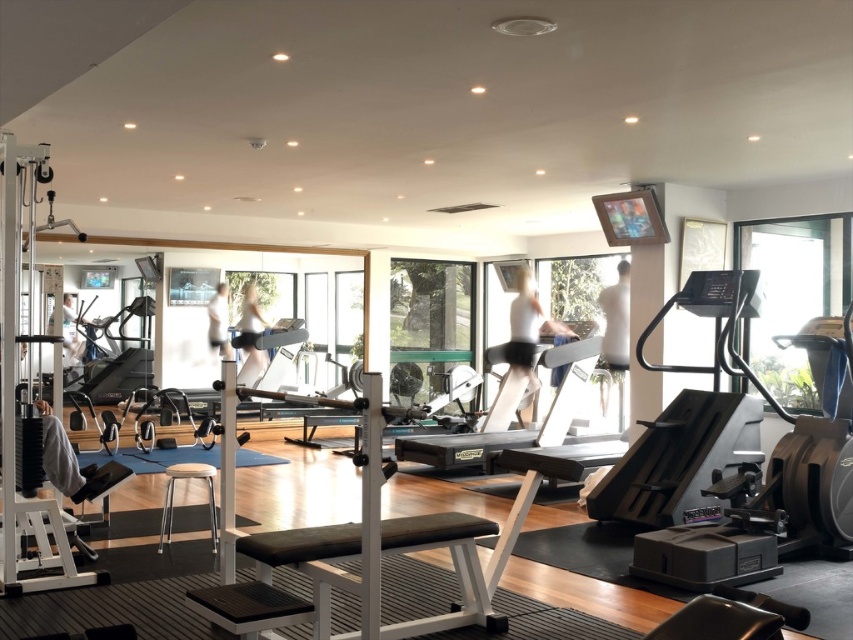
Consider the image. You are a gym member who wants to use a treadmill but prefers one that is taller. Which treadmill should you choose between the black plastic treadmill at center and the silver metallic treadmill at center?

The black plastic treadmill at center is taller than the silver metallic treadmill at center, so you should choose the black plastic treadmill at center.

You are a personal trainer in the gym and want to show a client the treadmill closest to the entrance. Both the black plastic treadmill at center and the silver metallic treadmill at center are in your line of sight. Which treadmill is closer to you?

The black plastic treadmill at center is closer to you because it is in front of the silver metallic treadmill at center.

You are a gym member trying to use the treadmill. You see the black plastic treadmill at center and the silver metallic treadmill at center. Which one is positioned higher up in the image?

The black plastic treadmill at center is located above the silver metallic treadmill at center, so it is positioned higher up in the image.